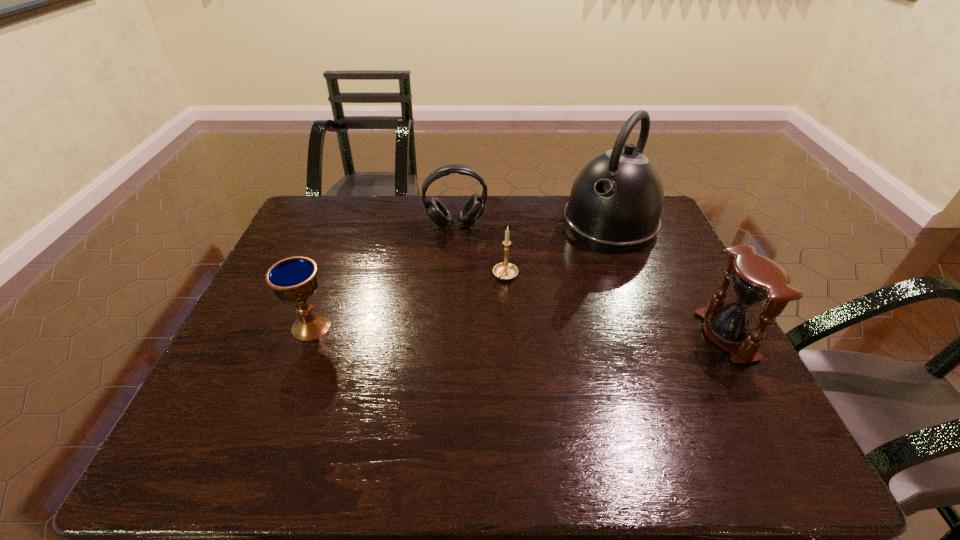
I want to click on vacant region that satisfies the following two spatial constraints: 1. on the back side of the kettle; 2. on the left side of the third object from left to right, so click(x=502, y=224).

Find the location of a particular element. The image size is (960, 540). vacant position in the image that satisfies the following two spatial constraints: 1. on the front side of the fourth object from right to left; 2. on the left side of the candle holder is located at coordinates (452, 276).